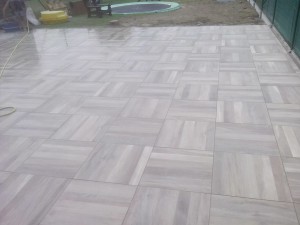
Find the location of a particular element. This screenshot has height=225, width=300. tile is located at coordinates (126, 97).